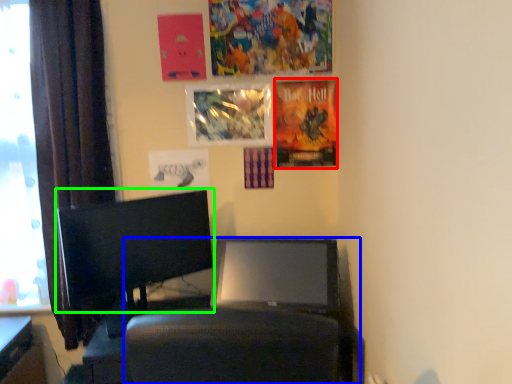
Question: Which is nearer to the poster page (highlighted by a red box)? computer chair (highlighted by a blue box) or computer monitor (highlighted by a green box).

Choices:
 (A) computer chair
 (B) computer monitor

Answer: (A)